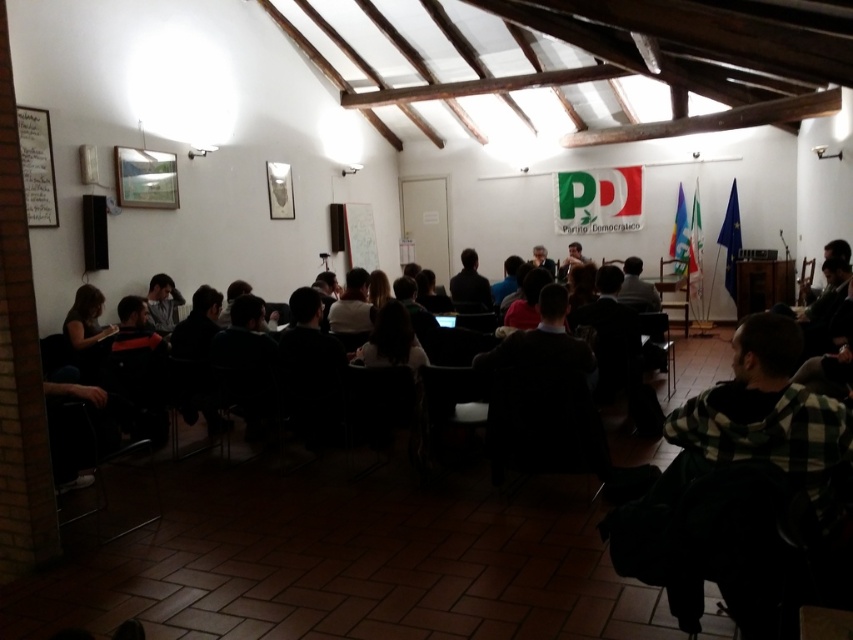
Question: Can you confirm if dark brown leather chair at center is bigger than light gray shirt at left?

Choices:
 (A) yes
 (B) no

Answer: (B)

Question: Which of the following is the farthest from the observer?

Choices:
 (A) (456, 304)
 (B) (166, 317)

Answer: (A)

Question: Which of the following is the farthest from the observer?

Choices:
 (A) (178, 291)
 (B) (479, 301)

Answer: (B)

Question: Can you confirm if dark brown leather chair at center is positioned to the left of light gray shirt at left?

Choices:
 (A) yes
 (B) no

Answer: (B)

Question: Is dark brown leather chair at center positioned behind light gray shirt at left?

Choices:
 (A) yes
 (B) no

Answer: (A)